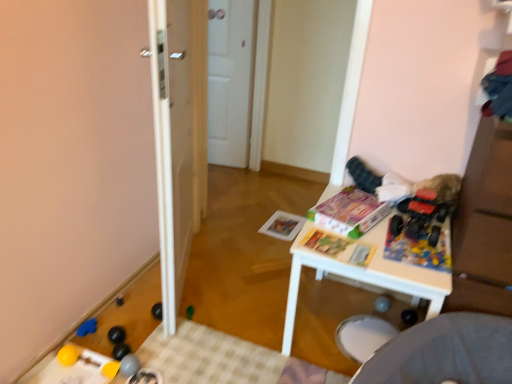
The image size is (512, 384). I want to click on vacant area to the right of rubber yellow ball at lower left, which is the 4th toy from right to left, so click(x=162, y=364).